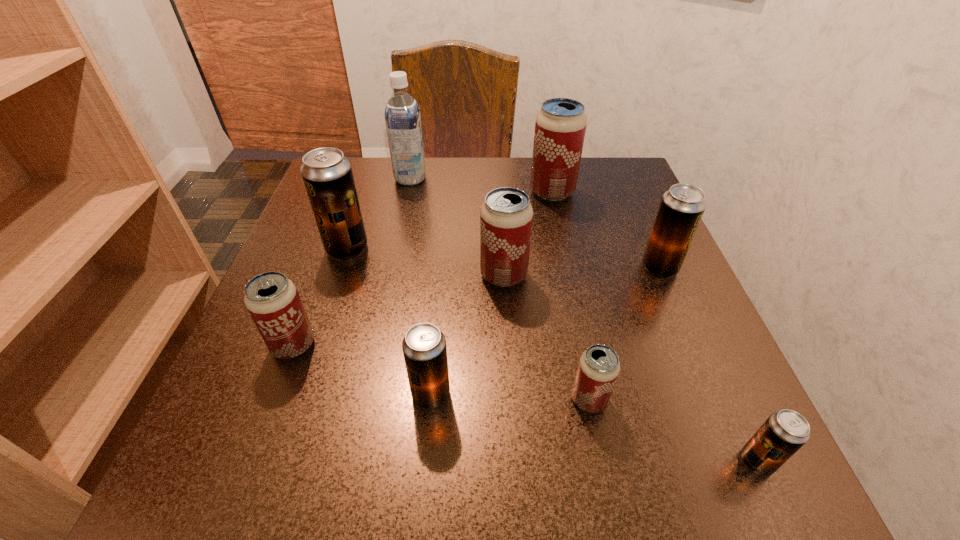
Where is `black beer can object that ranks as the second closest to the fifth object from left to right`? The image size is (960, 540). black beer can object that ranks as the second closest to the fifth object from left to right is located at coordinates (682, 206).

Choose which black beer can is the nearest neighbor to the second biggest black beer can. Please provide its 2D coordinates. Your answer should be formatted as a tuple, i.e. [(x, y)], where the tuple contains the x and y coordinates of a point satisfying the conditions above.

[(785, 431)]

Identify the location of free space that satisfies the following two spatial constraints: 1. on the front side of the leftmost red beer can; 2. on the left side of the nearest object. The width and height of the screenshot is (960, 540). (250, 462).

Identify the location of free location that satisfies the following two spatial constraints: 1. on the front side of the biggest black beer can; 2. on the right side of the nearest red beer can. The height and width of the screenshot is (540, 960). (297, 400).

Locate an element on the screen. vacant space that satisfies the following two spatial constraints: 1. on the back side of the third red beer can from right to left; 2. on the right side of the fourth object from left to right is located at coordinates (442, 275).